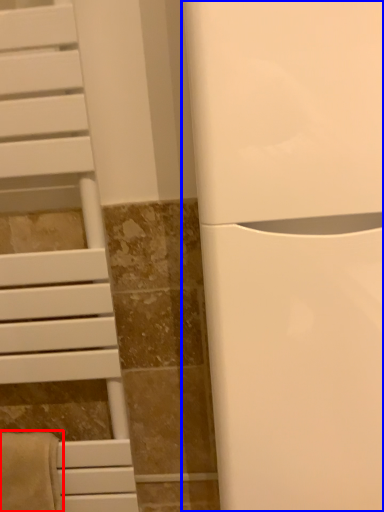
Question: Which point is further to the camera, bath towel (highlighted by a red box) or appliance (highlighted by a blue box)?

Choices:
 (A) bath towel
 (B) appliance

Answer: (A)